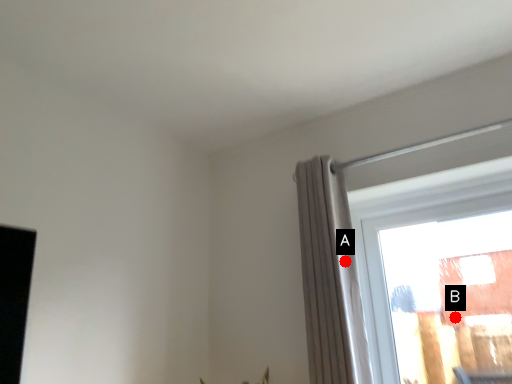
Question: Two points are circled on the image, labeled by A and B beside each circle. Among these points, which one is nearest to the camera?

Choices:
 (A) A is closer
 (B) B is closer

Answer: (A)